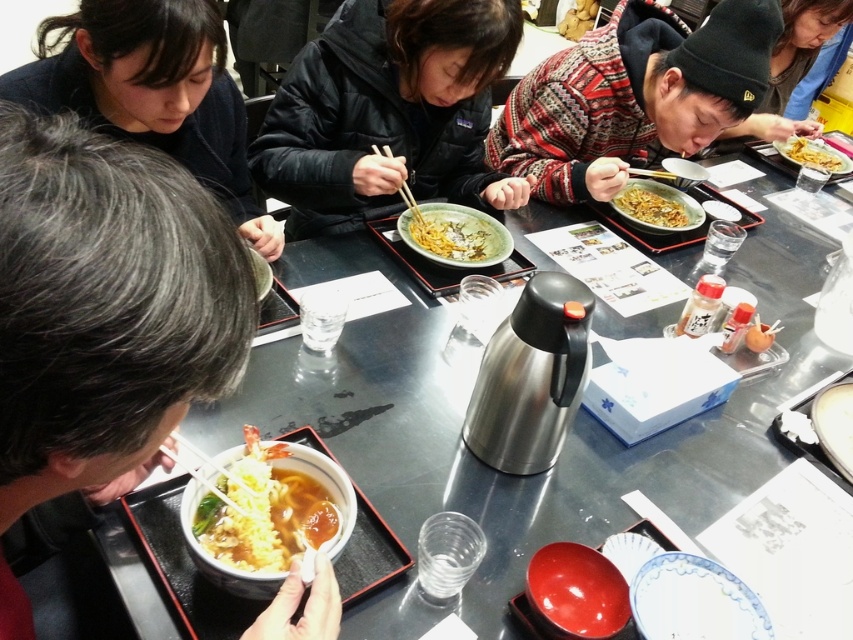
Looking at this image, who is positioned more to the right, dark brown hair at lower left or shiny yellow noodles at upper right?

From the viewer's perspective, shiny yellow noodles at upper right appears more on the right side.

Is point (123, 280) farther from viewer compared to point (815, 154)?

No.

Where is `dark brown hair at lower left`? Image resolution: width=853 pixels, height=640 pixels. dark brown hair at lower left is located at coordinates (105, 305).

This screenshot has height=640, width=853. What do you see at coordinates (631, 92) in the screenshot?
I see `knitted sweater at center` at bounding box center [631, 92].

Find the location of a particular element. This screenshot has height=640, width=853. knitted sweater at center is located at coordinates (631, 92).

Consider the image. Can you confirm if metallic stainless steel table at center is taller than shiny silver bowl at center?

Yes.

Which is above, metallic stainless steel table at center or shiny silver bowl at center?

shiny silver bowl at center is above.

Between point (338, 259) and point (653, 211), which one is positioned behind?

Positioned behind is point (653, 211).

The width and height of the screenshot is (853, 640). Find the location of `metallic stainless steel table at center`. metallic stainless steel table at center is located at coordinates (567, 435).